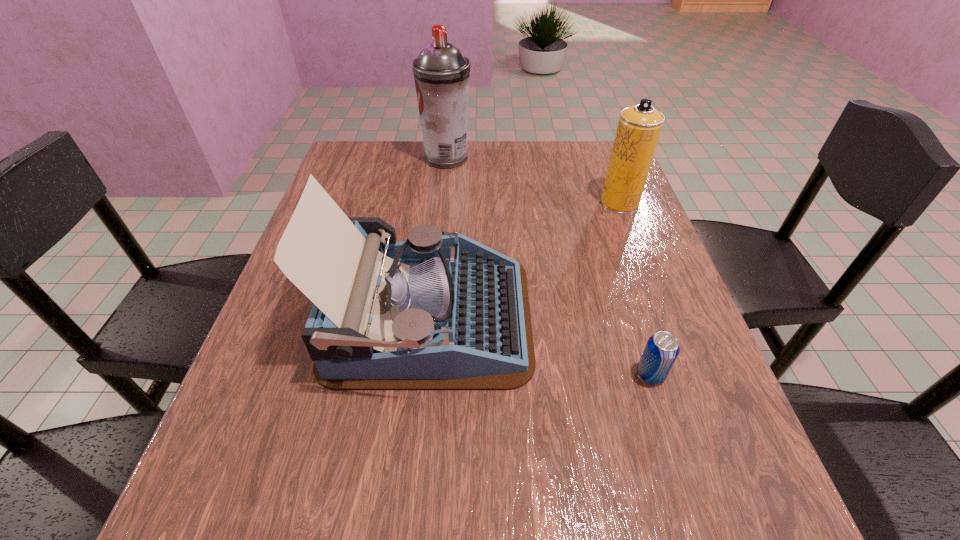
Find the location of a particular element. The height and width of the screenshot is (540, 960). object that is the second closest one to the right aerosol can is located at coordinates (441, 73).

Find the location of a particular element. The image size is (960, 540). the closest object to the farthest object is located at coordinates point(639,127).

Find the location of a particular element. Image resolution: width=960 pixels, height=540 pixels. blank space that satisfies the following two spatial constraints: 1. on the front side of the nearer aerosol can; 2. on the typing side of the typewriter is located at coordinates (663, 318).

The image size is (960, 540). Find the location of `free space in the image that satisfies the following two spatial constraints: 1. on the typing side of the typewriter; 2. on the back side of the beer can`. free space in the image that satisfies the following two spatial constraints: 1. on the typing side of the typewriter; 2. on the back side of the beer can is located at coordinates (423, 374).

At what (x,y) coordinates should I click in order to perform the action: click on free space in the image that satisfies the following two spatial constraints: 1. on the front side of the tallest object; 2. on the typing side of the typewriter. Please return your answer as a coordinate pair (x, y). Looking at the image, I should click on (430, 318).

Find the location of a particular element. This screenshot has width=960, height=540. blank space that satisfies the following two spatial constraints: 1. on the front side of the tallest object; 2. on the right side of the third nearest object is located at coordinates (442, 203).